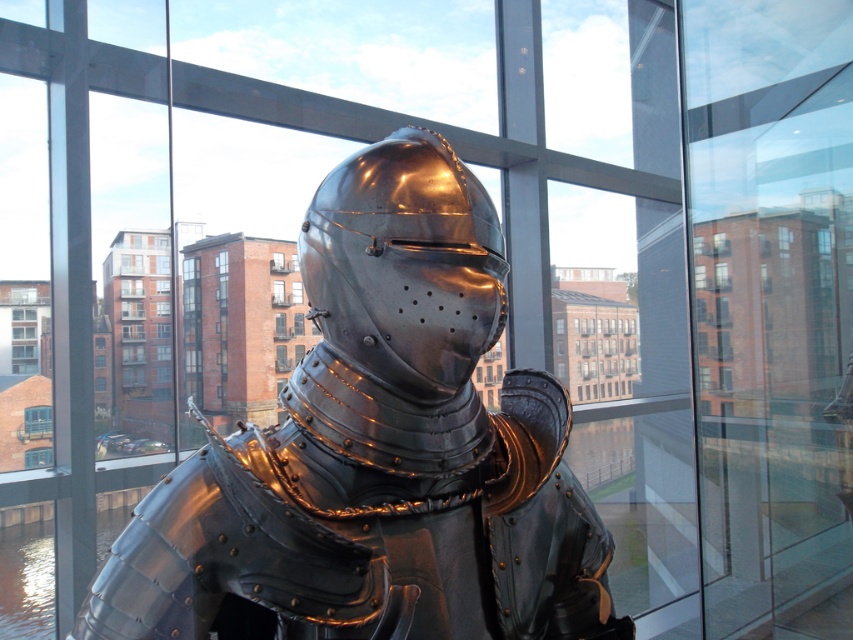
Is point (465, 588) positioned behind point (280, 289)?

No.

Who is more forward, (340,465) or (281,289)?

Positioned in front is point (340,465).

Identify the location of shiny metal armor at center. Image resolution: width=853 pixels, height=640 pixels. (378, 451).

Does shiny metal armor at center have a smaller size compared to shiny metallic helmet at center?

No.

The image size is (853, 640). Identify the location of shiny metal armor at center. (378, 451).

Does point (230, 518) come farther from viewer compared to point (445, 385)?

That is False.

Locate an element on the screen. The height and width of the screenshot is (640, 853). shiny metal armor at center is located at coordinates (378, 451).

Can you confirm if clear glass window at center is positioned to the left of brick wall at center?

Indeed, clear glass window at center is positioned on the left side of brick wall at center.

Which is in front, point (28, 413) or point (282, 285)?

Positioned in front is point (28, 413).

Image resolution: width=853 pixels, height=640 pixels. Identify the location of clear glass window at center. (38, 420).